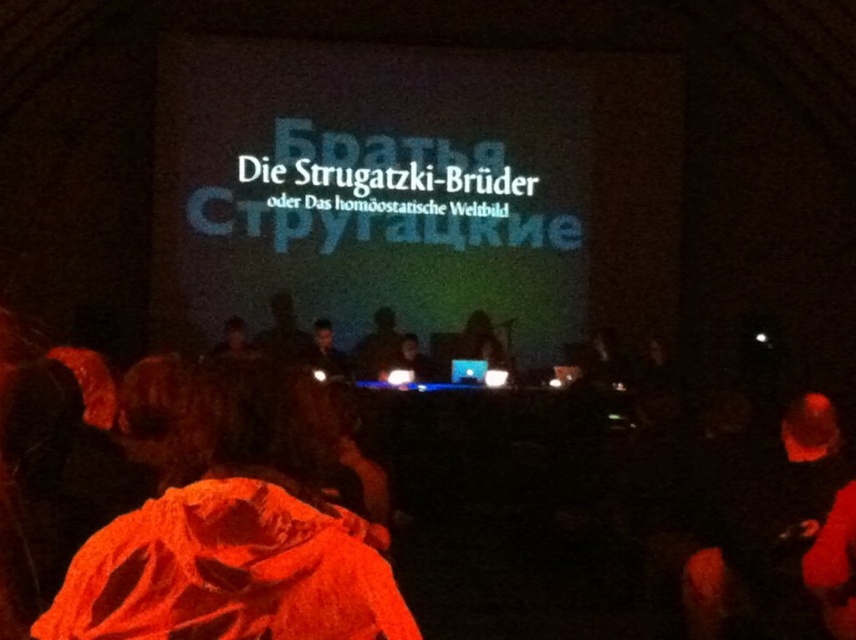
You are an attendee at this event and need to present a slide. You have a smooth black laptop at center and a matte white screen at center. Which device should you use to advance your slides?

You should use the smooth black laptop at center to advance your slides since it is positioned above the matte white screen at center, indicating it is the controlling device.

You are an attendee at this event and need to present your slides using your smooth black laptop at center. However, you notice the matte white screen at center is already displaying another presentation. Can you place your laptop to the left of the screen so it can be connected without blocking the audience view?

Yes, the smooth black laptop at center can be placed to the left of the matte white screen at center since it is already positioned on the left side of the screen, allowing for connection without blocking the audience view.

You are a presenter who needs to connect your smooth black laptop at center to the matte white screen at center. Based on their sizes, do you think the laptop will fit on the screen when displayed?

The smooth black laptop at center is much taller than the matte white screen at center, so when connected, the laptop may not fit entirely on the screen due to its greater height.